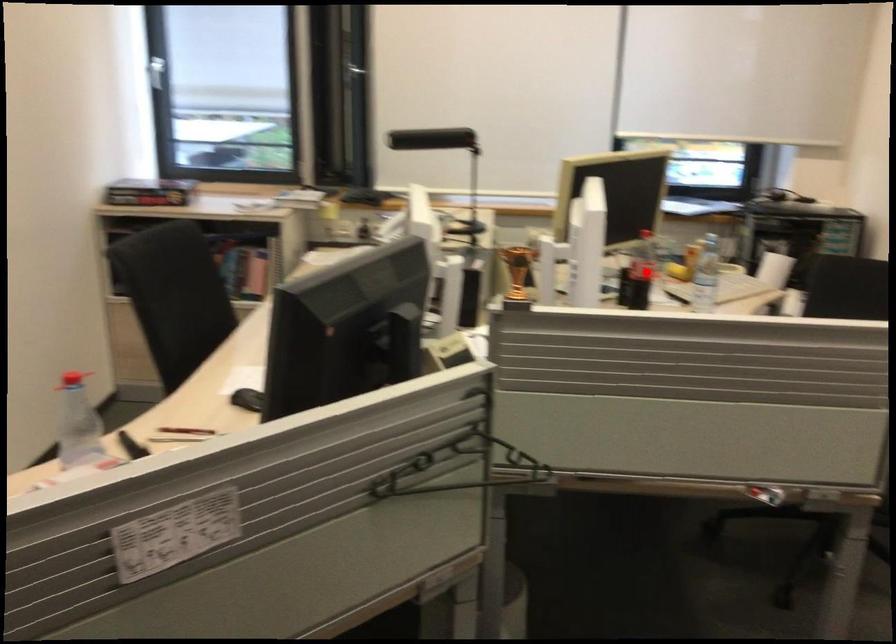
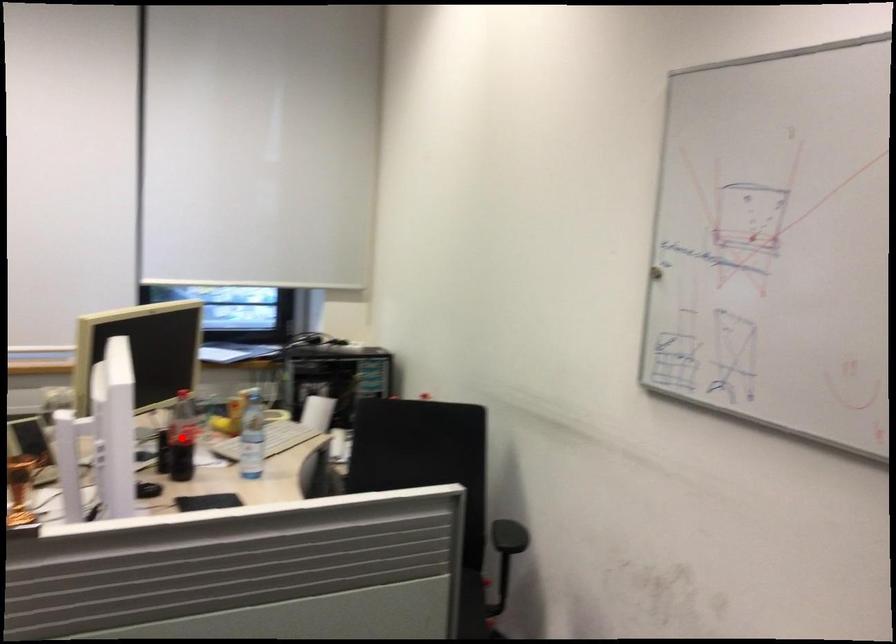
I am providing you with two images of the same scene from different viewpoints. A red point is marked on the first image and another point is marked on the second image. Do the highlighted points in image1 and image2 indicate the same real-world spot?

Yes